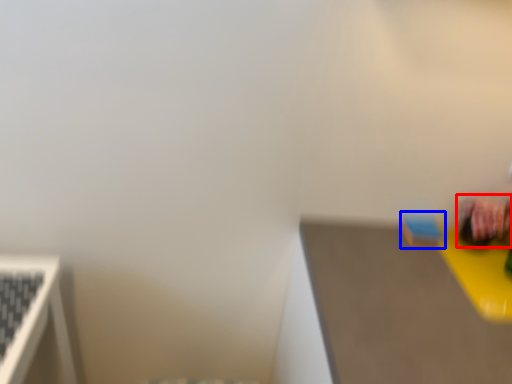
Question: Which object is closer to the camera taking this photo, toy (highlighted by a red box) or toy (highlighted by a blue box)?

Choices:
 (A) toy
 (B) toy

Answer: (A)